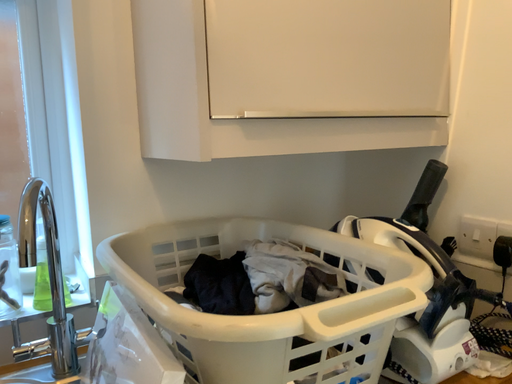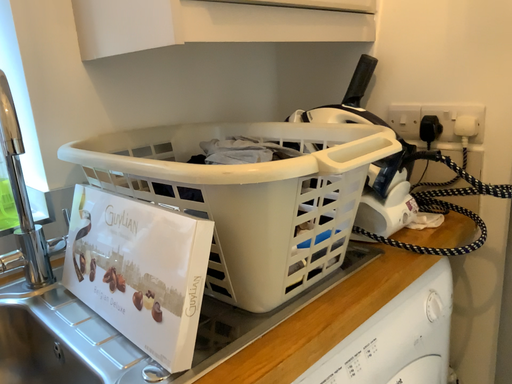
Question: How did the camera likely rotate when shooting the video?

Choices:
 (A) rotated downward
 (B) rotated upward

Answer: (A)